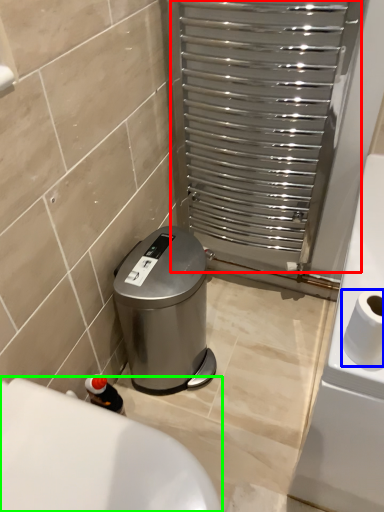
Question: Considering the real-world distances, which object is closest to screen door (highlighted by a red box)? toilet paper (highlighted by a blue box) or bath (highlighted by a green box).

Choices:
 (A) toilet paper
 (B) bath

Answer: (A)